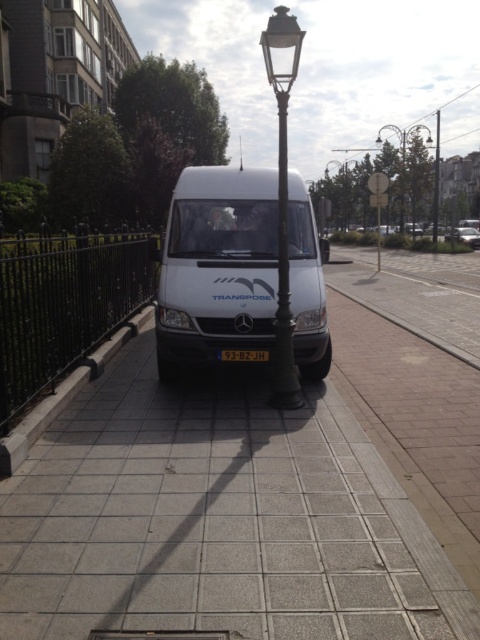
Between point (9, 500) and point (468, 228), which one is positioned in front?

Point (9, 500) is more forward.

Find the location of a particular element. The height and width of the screenshot is (640, 480). gray concrete pavement at center is located at coordinates (217, 518).

Where is `gray concrete pavement at center`? This screenshot has height=640, width=480. gray concrete pavement at center is located at coordinates (217, 518).

At what (x,y) coordinates should I click in order to perform the action: click on gray concrete pavement at center. Please return your answer as a coordinate pair (x, y). The width and height of the screenshot is (480, 640). Looking at the image, I should click on (217, 518).

Which is behind, point (448, 509) or point (274, 368)?

Positioned behind is point (274, 368).

Which is below, gray concrete pavement at center or dark bronze streetlamp at center?

Positioned lower is gray concrete pavement at center.

Is point (120, 452) positioned behind point (280, 348)?

No, (120, 452) is closer to viewer.

Where is `gray concrete pavement at center`? gray concrete pavement at center is located at coordinates (217, 518).

Which is in front, point (180, 204) or point (233, 352)?

Point (233, 352) is in front.

What are the coordinates of `white matte van at center` in the screenshot? It's located at (217, 266).